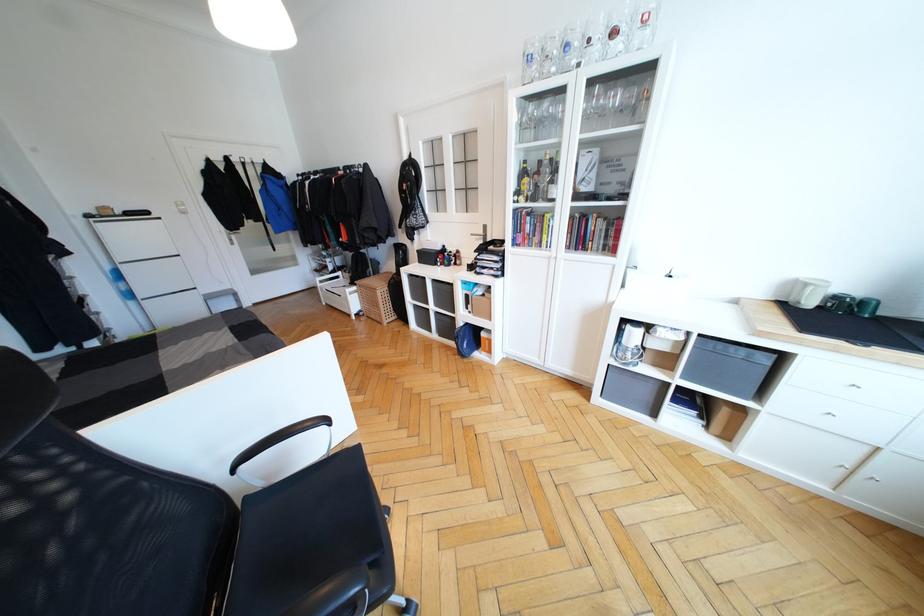
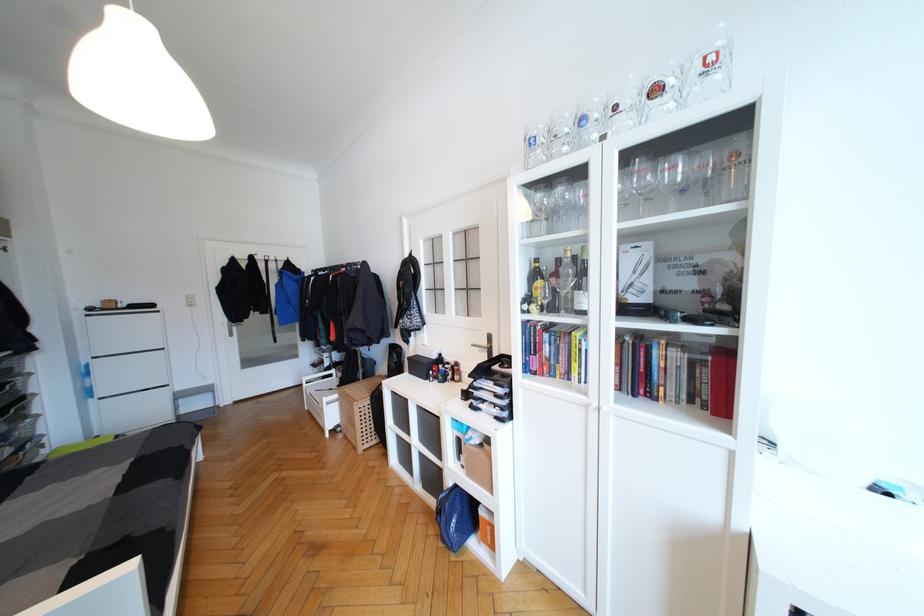
In the second image, find the point that corresponds to point 142,298 in the first image.

(103, 395)